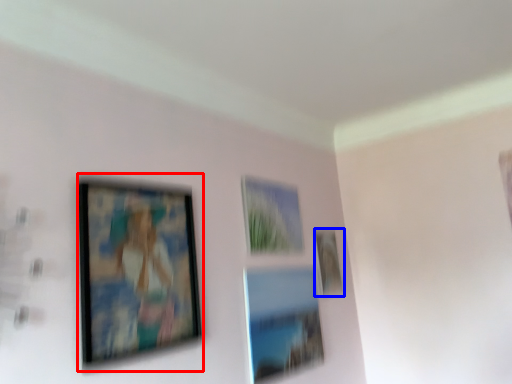
Question: Among these objects, which one is nearest to the camera, picture frame (highlighted by a red box) or picture frame (highlighted by a blue box)?

Choices:
 (A) picture frame
 (B) picture frame

Answer: (A)